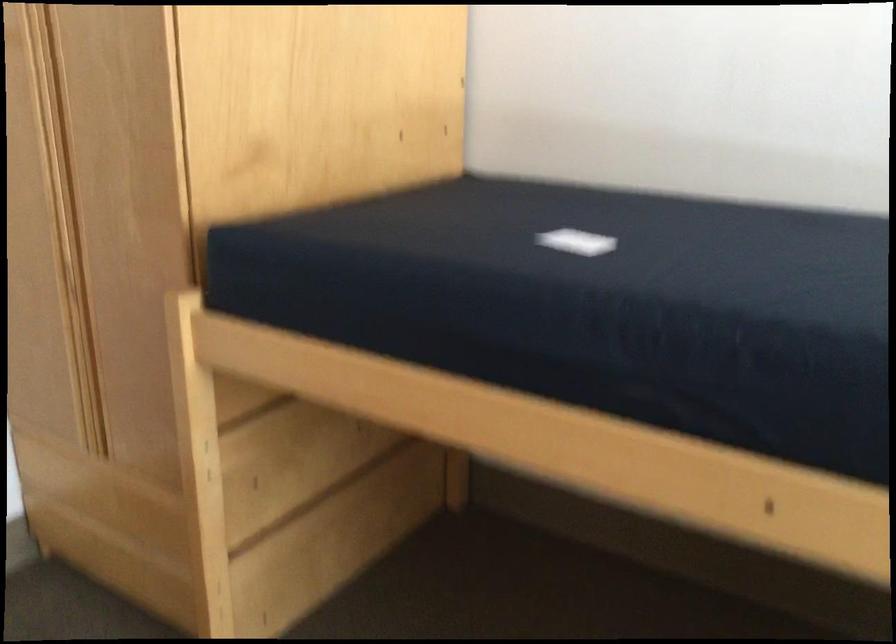
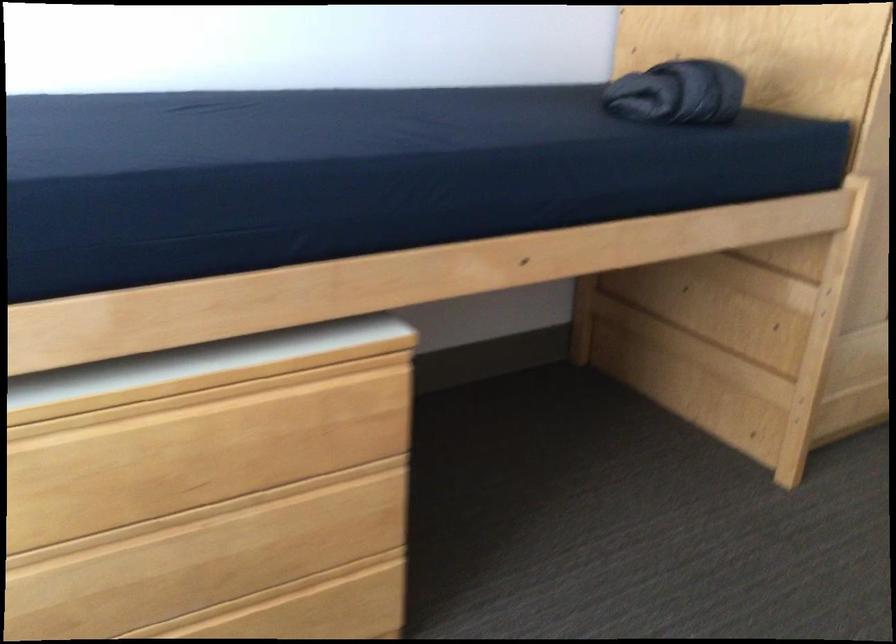
Based on the continuous images, in which direction is the camera rotating?

The camera's rotation is toward left-down.